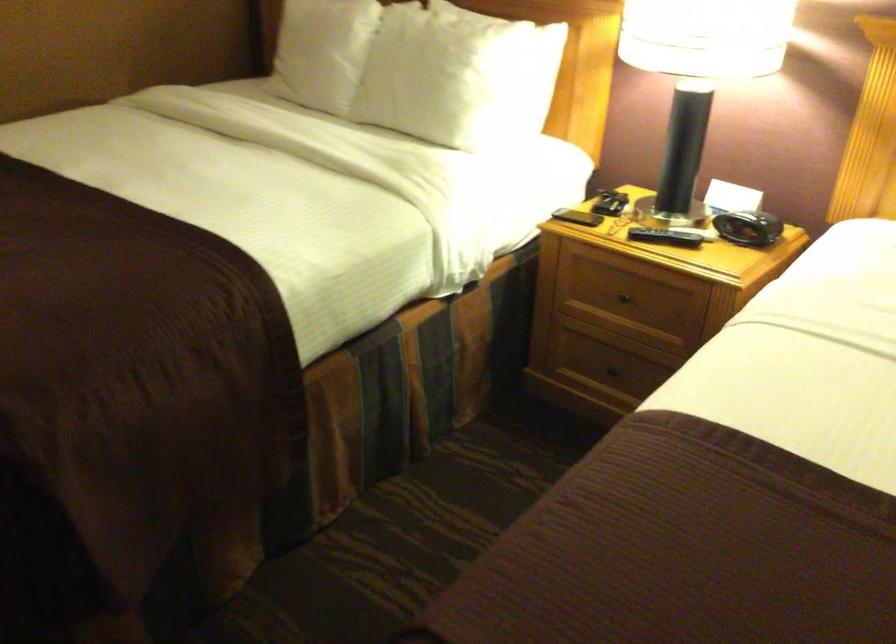
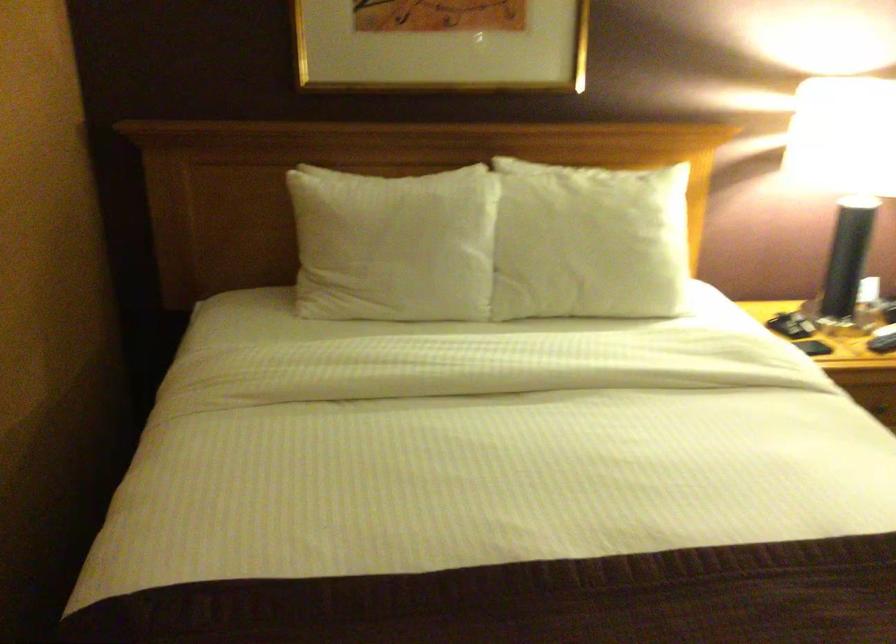
Locate, in the second image, the point that corresponds to the point at 417,70 in the first image.

(589, 242)